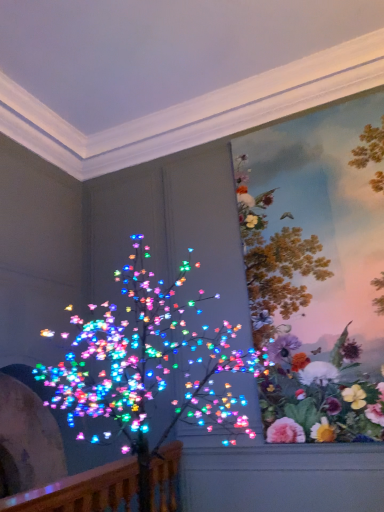
Question: Is wooden at left positioned behind multicolored lights at left?

Choices:
 (A) yes
 (B) no

Answer: (A)

Question: From the image's perspective, is wooden at left on multicolored lights at left?

Choices:
 (A) no
 (B) yes

Answer: (A)

Question: Does wooden at left have a lesser height compared to multicolored lights at left?

Choices:
 (A) yes
 (B) no

Answer: (A)

Question: Is wooden at left next to multicolored lights at left and touching it?

Choices:
 (A) yes
 (B) no

Answer: (B)

Question: Is wooden at left positioned before multicolored lights at left?

Choices:
 (A) yes
 (B) no

Answer: (B)

Question: Can you confirm if wooden at left is bigger than multicolored lights at left?

Choices:
 (A) yes
 (B) no

Answer: (B)

Question: From a real-world perspective, is multicolored lights at left physically above floral wallpaper at upper right?

Choices:
 (A) no
 (B) yes

Answer: (A)

Question: Does multicolored lights at left have a smaller size compared to floral wallpaper at upper right?

Choices:
 (A) yes
 (B) no

Answer: (B)

Question: Is multicolored lights at left at the right side of floral wallpaper at upper right?

Choices:
 (A) no
 (B) yes

Answer: (A)

Question: From the image's perspective, is multicolored lights at left above floral wallpaper at upper right?

Choices:
 (A) yes
 (B) no

Answer: (B)

Question: Are multicolored lights at left and floral wallpaper at upper right far apart?

Choices:
 (A) yes
 (B) no

Answer: (B)

Question: Considering the relative sizes of multicolored lights at left and floral wallpaper at upper right in the image provided, is multicolored lights at left taller than floral wallpaper at upper right?

Choices:
 (A) yes
 (B) no

Answer: (B)

Question: Is floral wallpaper at upper right oriented away from wooden at left?

Choices:
 (A) no
 (B) yes

Answer: (A)